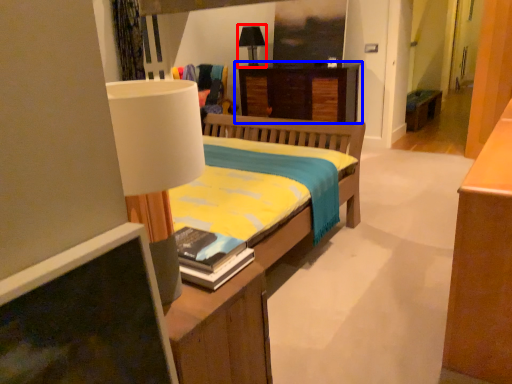
Question: Which point is further to the camera, table lamp (highlighted by a red box) or desk (highlighted by a blue box)?

Choices:
 (A) table lamp
 (B) desk

Answer: (A)